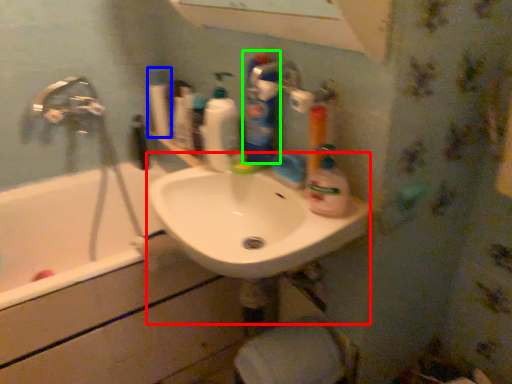
Question: Which object is the closest to the sink (highlighted by a red box)? Choose among these: cleaning product (highlighted by a blue box) or cleaning product (highlighted by a green box).

Choices:
 (A) cleaning product
 (B) cleaning product

Answer: (B)